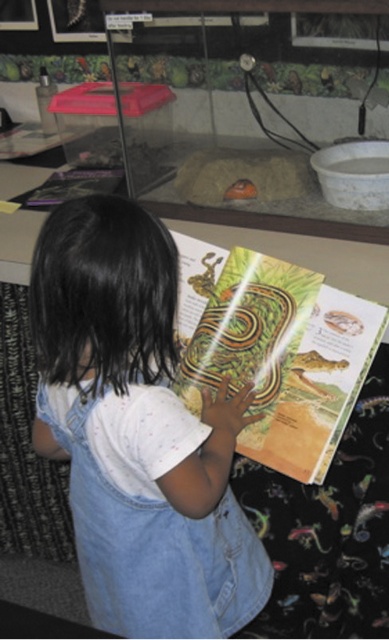
Can you confirm if denim overalls at center is bigger than matte yellow book at center?

Correct, denim overalls at center is larger in size than matte yellow book at center.

Is denim overalls at center taller than matte yellow book at center?

Yes.

Locate an element on the screen. The height and width of the screenshot is (640, 389). denim overalls at center is located at coordinates (136, 432).